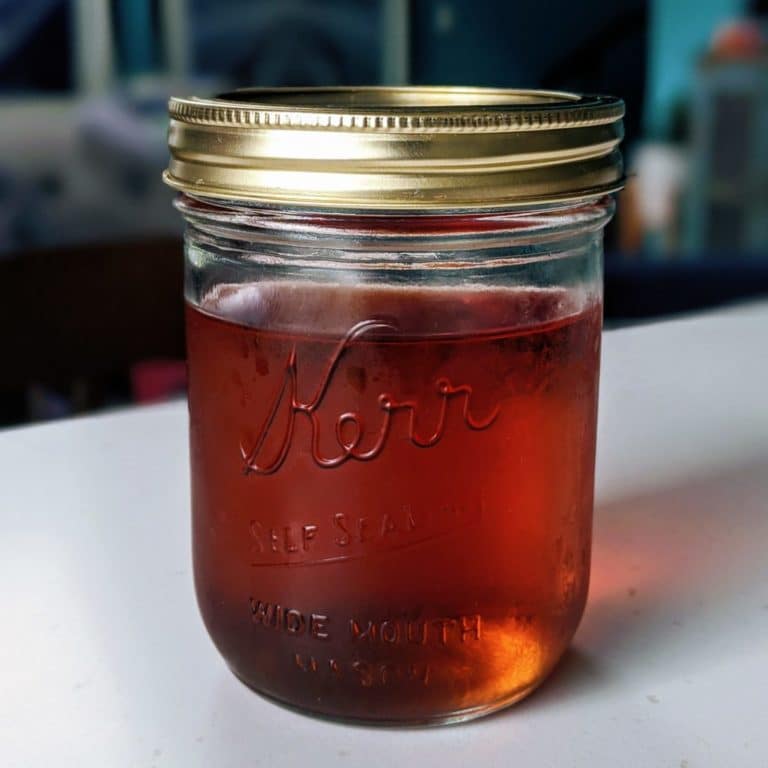
Image resolution: width=768 pixels, height=768 pixels. In order to click on white surface to left of jar in this screenshot , I will do `click(137, 601)`.